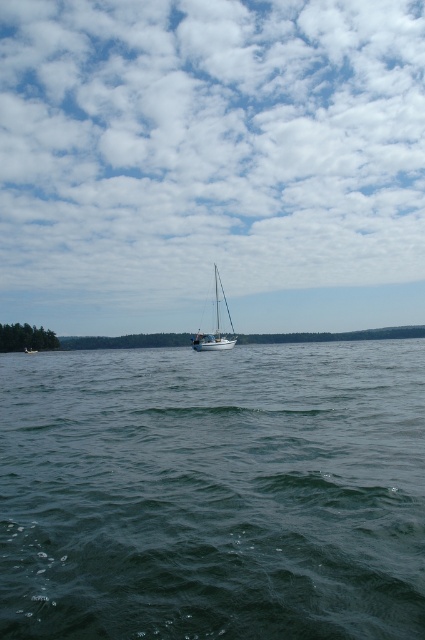
You are an observer standing on the lakeside shore. You see the dark blue water at center and the white sailboat at center. Which object is located to the right of the other?

The dark blue water at center is positioned on the right side of white sailboat at center, so the dark blue water at center is to the right of the white sailboat at center.

You are a photographer planning to capture the white fluffy cloud at upper center and the white sailboat at center in a single shot. Based on their sizes in the image, which object would appear larger in your photograph?

The white fluffy cloud at upper center appears larger than the white sailboat at center in the image because it is taller according to the description.